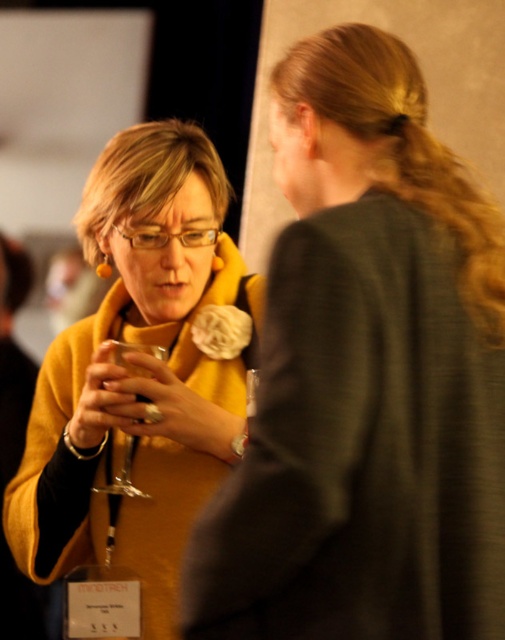
You are organizing a fashion show and need to arrange two yellow items from left to right based on their widths. Given that you have the matte yellow scarf at left and the matte yellow sweater at center, which one should be placed first on the runway?

The matte yellow scarf at left should be placed first because it is narrower than the matte yellow sweater at center, allowing the items to be arranged from left to right in increasing width order.

You are a photographer at the event and want to capture a closeup shot of both the matte yellow scarf at left and the matte yellow sweater at center. Your camera has a maximum focus range of 17 inches. Can you capture both items in focus simultaneously?

The matte yellow scarf at left is 17.32 inches from the matte yellow sweater at center. Since the distance between them exceeds the camera maximum focus range of 17 inches, you cannot capture both items in focus simultaneously.

You are at a conference and need to reach for the clear glass wine glass at center without disturbing the matte yellow sweater at center. Is this possible?

The matte yellow sweater at center is in front of the clear glass wine glass at center, so you can reach for the clear glass wine glass at center by moving around the matte yellow sweater at center.